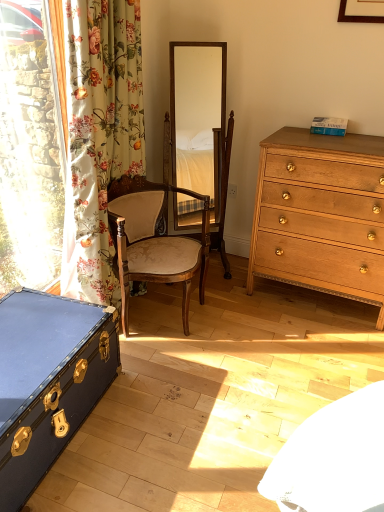
At what (x,y) coordinates should I click in order to perform the action: click on vacant area situated below wooden chair at center (from a real-world perspective). Please return your answer as a coordinate pair (x, y). Image resolution: width=384 pixels, height=512 pixels. Looking at the image, I should click on pyautogui.click(x=170, y=315).